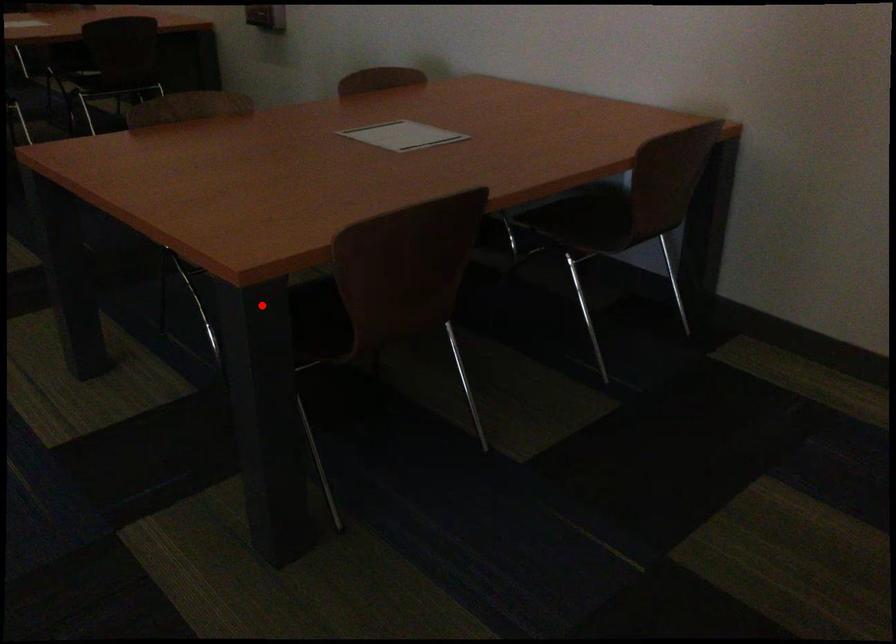
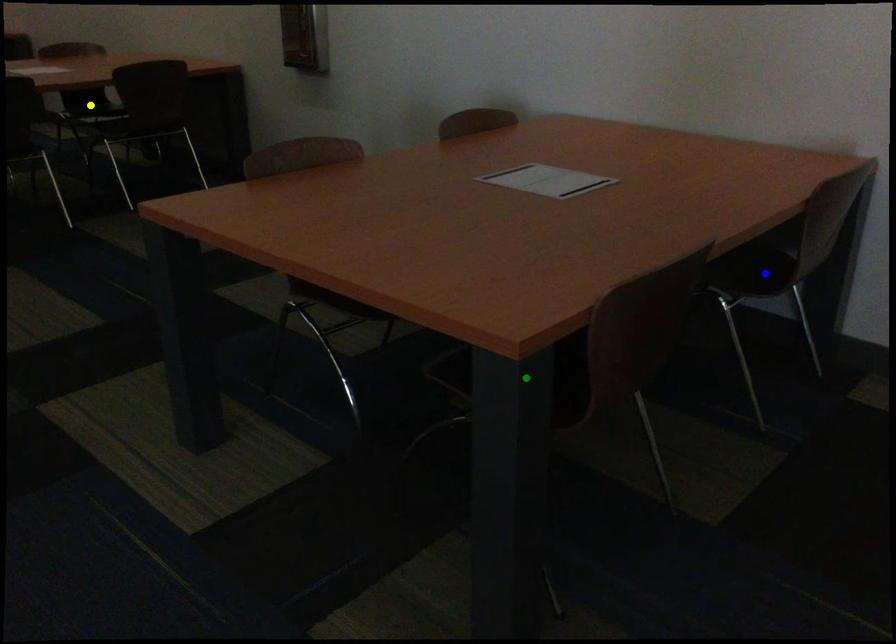
Question: I am providing you with two images of the same scene from different viewpoints. A red point is marked on the first image. You are given multiple points on the second image. In image 2, which mark is for the same physical point as the one in image 1?

Choices:
 (A) blue point
 (B) yellow point
 (C) green point

Answer: (C)